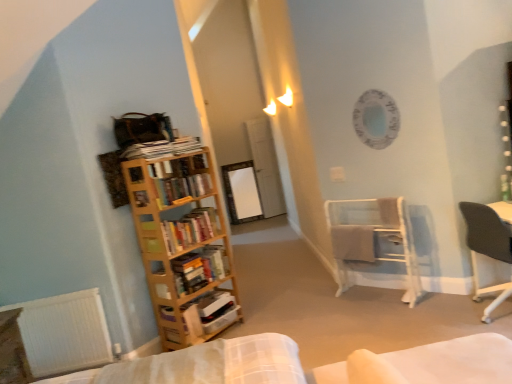
Image resolution: width=512 pixels, height=384 pixels. In order to click on vacant space to the left of white metal towel rack at center right in this screenshot , I will do `click(320, 316)`.